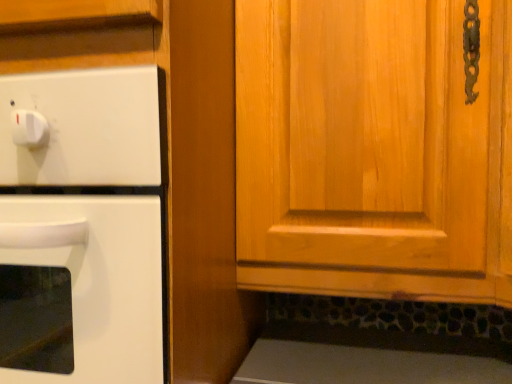
Question: In terms of width, does white glossy oven at left look wider or thinner when compared to wooden cabinet at center?

Choices:
 (A) wide
 (B) thin

Answer: (B)

Question: Considering the positions of point (148, 135) and point (271, 213), is point (148, 135) closer or farther from the camera than point (271, 213)?

Choices:
 (A) closer
 (B) farther

Answer: (A)

Question: Is white glossy oven at left taller or shorter than wooden cabinet at center?

Choices:
 (A) tall
 (B) short

Answer: (A)

Question: Is wooden cabinet at center in front of or behind white glossy oven at left in the image?

Choices:
 (A) behind
 (B) front

Answer: (B)

Question: Is point (456, 178) positioned closer to the camera than point (37, 130)?

Choices:
 (A) farther
 (B) closer

Answer: (A)

Question: Which is correct: wooden cabinet at center is inside white glossy oven at left, or outside of it?

Choices:
 (A) inside
 (B) outside

Answer: (B)

Question: From the image's perspective, is wooden cabinet at center above or below white glossy oven at left?

Choices:
 (A) above
 (B) below

Answer: (A)